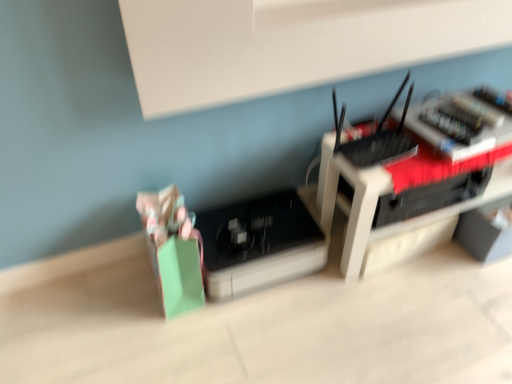
Question: Is black plastic router at center smaller than black plastic router at upper right, placed as the 2th register when sorted from left to right?

Choices:
 (A) yes
 (B) no

Answer: (B)

Question: From a real-world perspective, is black plastic router at center located beneath black plastic router at upper right, which ranks as the 2th register in bottom-to-top order?

Choices:
 (A) no
 (B) yes

Answer: (B)

Question: Is black plastic router at center taller than black plastic router at upper right, placed as the 2th register when sorted from left to right?

Choices:
 (A) no
 (B) yes

Answer: (B)

Question: Does black plastic router at center have a lesser height compared to black plastic router at upper right, the 1th register when ordered from top to bottom?

Choices:
 (A) yes
 (B) no

Answer: (B)

Question: Considering the relative positions of black plastic router at center and black plastic router at upper right, which ranks as the 2th register in bottom-to-top order, in the image provided, is black plastic router at center to the left of black plastic router at upper right, which ranks as the 2th register in bottom-to-top order, from the viewer's perspective?

Choices:
 (A) no
 (B) yes

Answer: (A)

Question: Does point (203, 268) appear closer or farther from the camera than point (377, 162)?

Choices:
 (A) closer
 (B) farther

Answer: (B)

Question: From a real-world perspective, is black plastic register at center, marked as the first register in a back-to-front arrangement, positioned above or below black plastic router at upper right, positioned as the 2th register in back-to-front order?

Choices:
 (A) below
 (B) above

Answer: (A)

Question: Is black plastic register at center, marked as the first register in a bottom-to-top arrangement, bigger or smaller than black plastic router at upper right, positioned as the first register in front-to-back order?

Choices:
 (A) big
 (B) small

Answer: (A)

Question: From the image's perspective, is black plastic register at center, placed as the second register when sorted from right to left, located above or below black plastic router at upper right, positioned as the first register in front-to-back order?

Choices:
 (A) above
 (B) below

Answer: (B)

Question: Would you say black plastic router at upper right, the 1th register when ordered from top to bottom, is inside or outside black plastic router at center?

Choices:
 (A) outside
 (B) inside

Answer: (A)

Question: In the image, is black plastic router at upper right, which ranks as the 2th register in bottom-to-top order, positioned in front of or behind black plastic router at center?

Choices:
 (A) behind
 (B) front

Answer: (B)

Question: From a real-world perspective, relative to black plastic router at center, is black plastic router at upper right, the 1th register when ordered from top to bottom, vertically above or below?

Choices:
 (A) below
 (B) above

Answer: (B)

Question: Is point (411, 84) positioned closer to the camera than point (400, 235)?

Choices:
 (A) farther
 (B) closer

Answer: (A)

Question: Is black plastic router at center taller or shorter than black plastic register at center, the 2th register from the top?

Choices:
 (A) short
 (B) tall

Answer: (B)

Question: From a real-world perspective, relative to black plastic register at center, marked as the first register in a bottom-to-top arrangement, is black plastic router at center vertically above or below?

Choices:
 (A) below
 (B) above

Answer: (B)